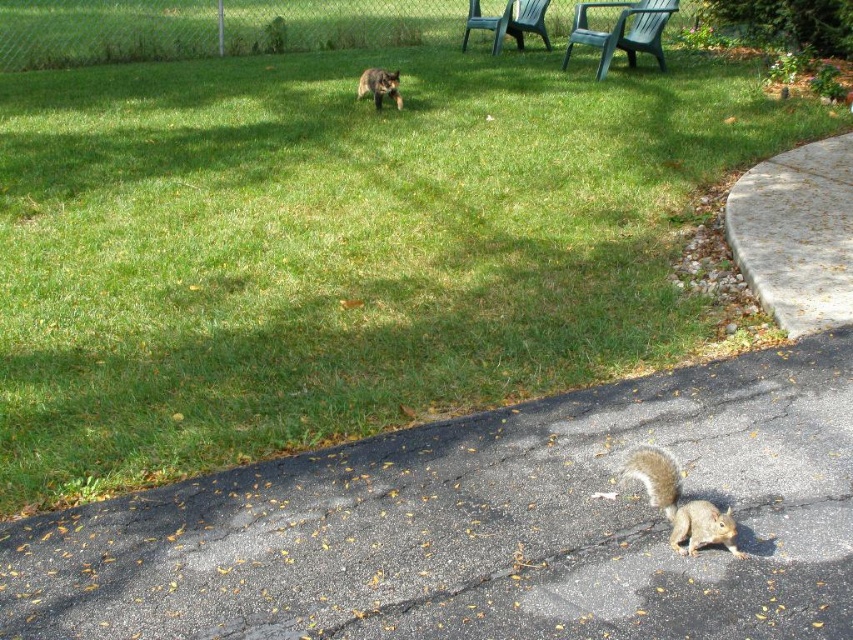
You are standing in the middle of the grassy yard and see both the gray furry squirrel at lower right and the fuzzy brown squirrel at upper center. Which squirrel is closer to you?

The gray furry squirrel at lower right is closer to the viewer than the fuzzy brown squirrel at upper center.

You are a photographer trying to capture a photo of the gray furry squirrel at lower right and the green plastic chair at upper right in the same frame. Based on their positions, will the squirrel appear smaller or larger in the photo compared to the chair?

The gray furry squirrel at lower right is below the green plastic chair at upper right. Since the squirrel is closer to the camera than the chair, it will appear larger in the photo.

You are standing in the middle of the yard and want to move towards the two points marked in the image. Which point, point [65,516] or point [396,106], will you reach first?

Point [65,516] is closer to the camera than point [396,106], so you will reach point [65,516] first.